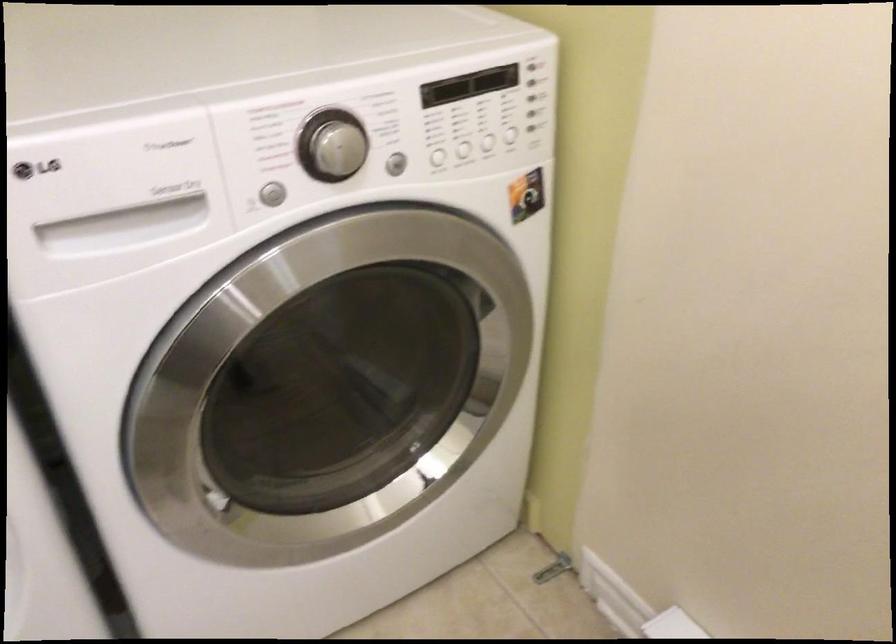
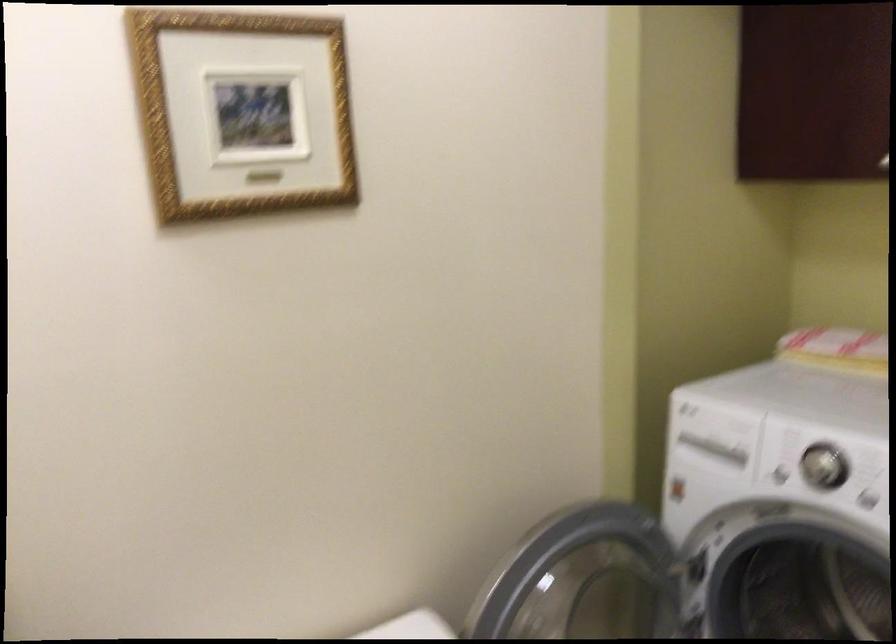
Question: The camera is either moving clockwise (left) or counter-clockwise (right) around the object. The first image is from the beginning of the video and the second image is from the end. Is the camera moving left or right when shooting the video?

Choices:
 (A) Left
 (B) Right

Answer: (B)